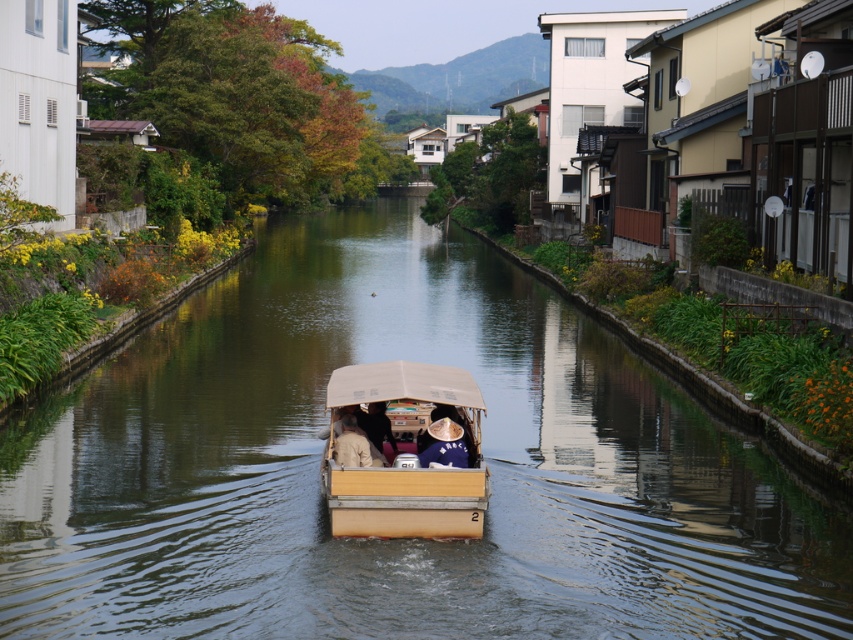
Question: Which of the following is the closest to the observer?

Choices:
 (A) wooden boat at center
 (B) light brown wooden boat at center
 (C) light brown fabric hat at center
 (D) brown straw hat at center

Answer: (A)

Question: Is brown wooden boat at center thinner than light brown wooden boat at center?

Choices:
 (A) yes
 (B) no

Answer: (B)

Question: Which is nearer to the wooden boat at center?

Choices:
 (A) brown wooden boat at center
 (B) light brown fabric hat at center

Answer: (B)

Question: Can you confirm if brown wooden boat at center is positioned above wooden boat at center?

Choices:
 (A) no
 (B) yes

Answer: (B)

Question: Among these points, which one is farthest from the camera?

Choices:
 (A) (485, 472)
 (B) (212, 336)
 (C) (373, 436)

Answer: (B)

Question: Can you confirm if brown straw hat at center is thinner than light brown wooden boat at center?

Choices:
 (A) no
 (B) yes

Answer: (A)